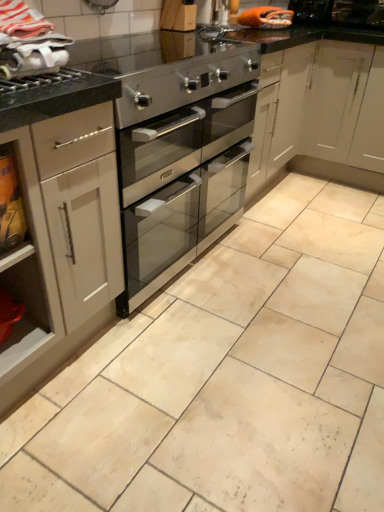
Where is `vacant space situated above satin silver oven at center (from a real-world perspective)`? vacant space situated above satin silver oven at center (from a real-world perspective) is located at coordinates (264, 298).